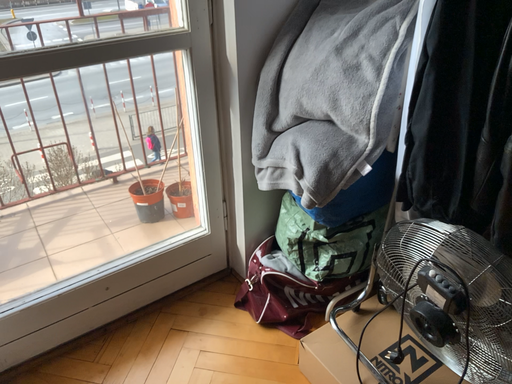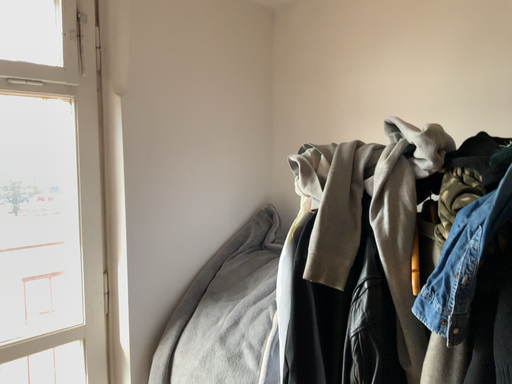
Question: How did the camera likely rotate when shooting the video?

Choices:
 (A) rotated downward
 (B) rotated upward

Answer: (B)